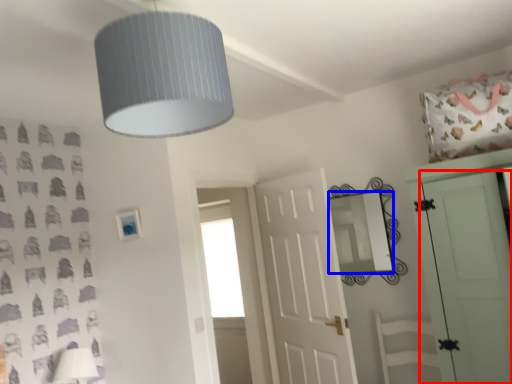
Question: Which of the following is the farthest to the observer, door (highlighted by a red box) or mirror (highlighted by a blue box)?

Choices:
 (A) door
 (B) mirror

Answer: (B)